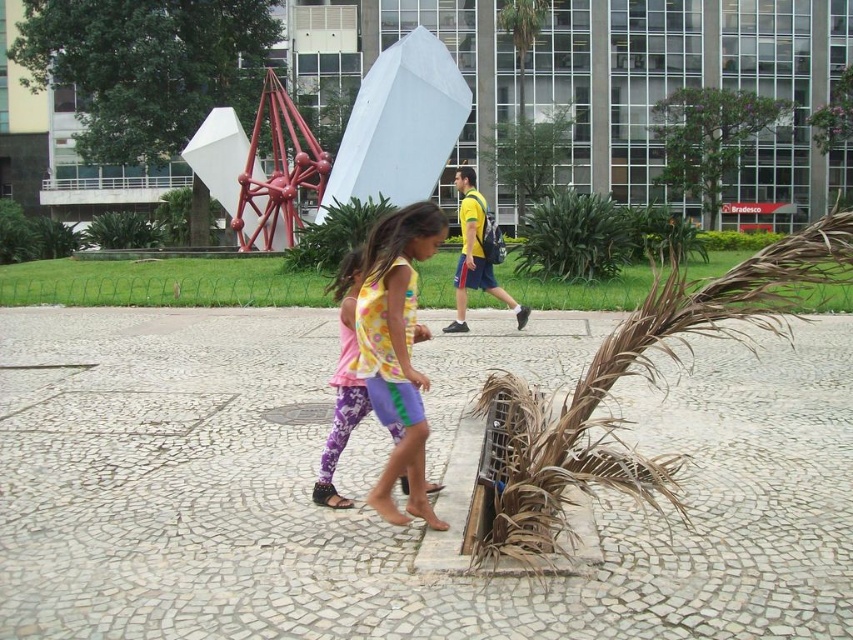
You are a photographer setting up a tripod in the plaza. You need to position it so that both the multicolored fabric dress at center and the brown textured palm tree at upper center are visible in the frame. Given their sizes, which object should you ensure is closer to the camera to avoid one blocking the other?

Since the multicolored fabric dress at center is wider than the brown textured palm tree at upper center, you should position the multicolored fabric dress at center closer to the camera. This way, its larger width won

You are standing in the plaza and see the brown dried palm at lower right and the brown textured palm tree at upper center. Which one is positioned more to the east side of the plaza?

The brown dried palm at lower right is positioned to the right of the brown textured palm tree at upper center, so it is more to the east side of the plaza.